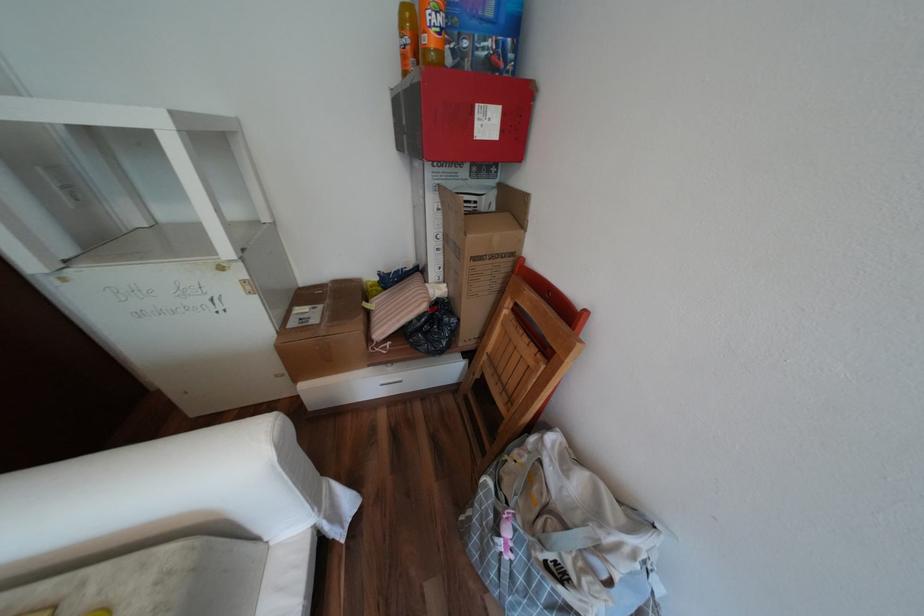
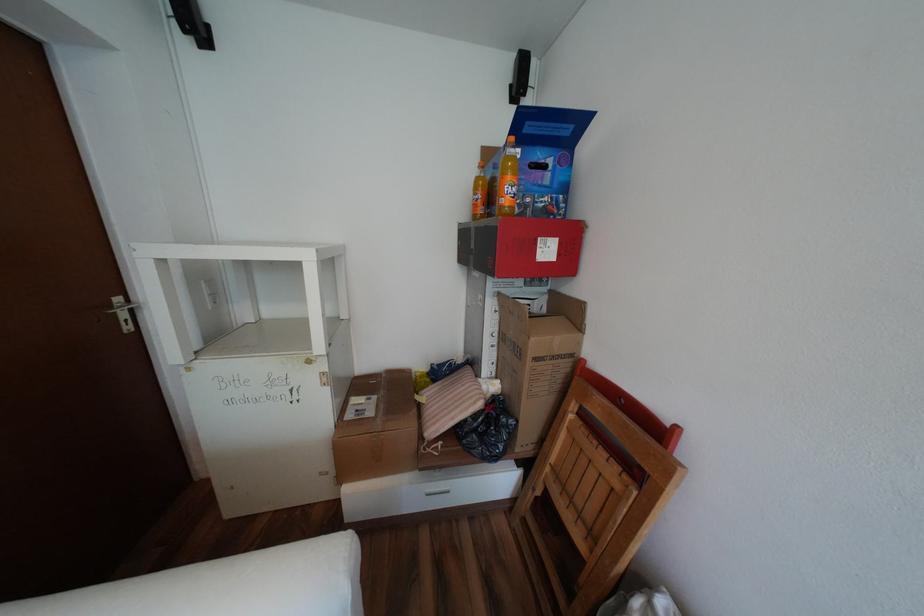
Locate, in the second image, the point that corresponds to point (450, 237) in the first image.

(505, 334)